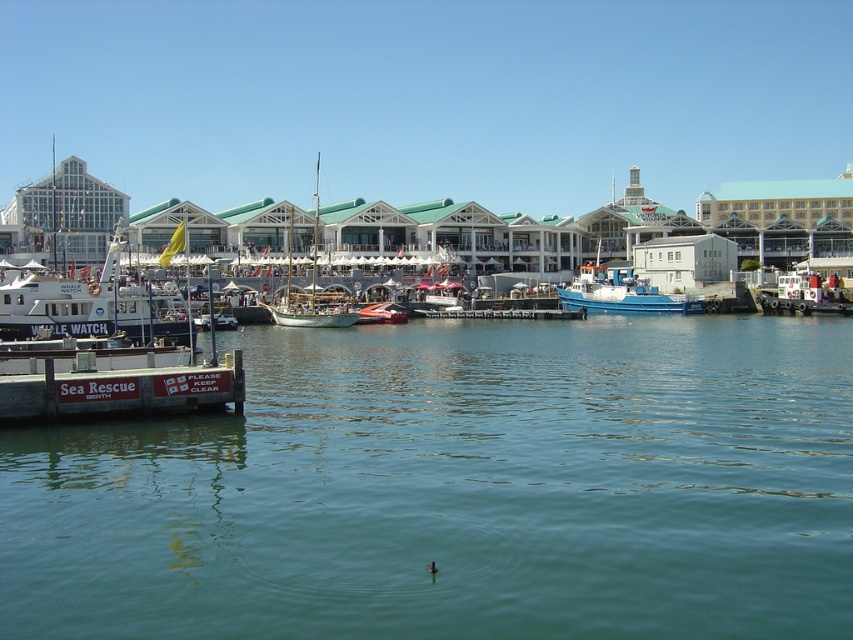
You are a boat captain who needs to navigate between the wooden dock at lower left and the wooden dock at center. Given that your boat requires a minimum of 60 meters of space to maneuver safely between docks, can you safely navigate between them?

The distance between the wooden dock at lower left and the wooden dock at center is 67.76 meters, which exceeds the boat captain required 60 meters of space. Therefore, the boat can safely navigate between them.

You are standing on the wooden dock at lower left and want to reach the wooden dock at center. Which direction should you move to get there?

Since the wooden dock at lower left is in front of the wooden dock at center, you should move backward to reach the wooden dock at center.